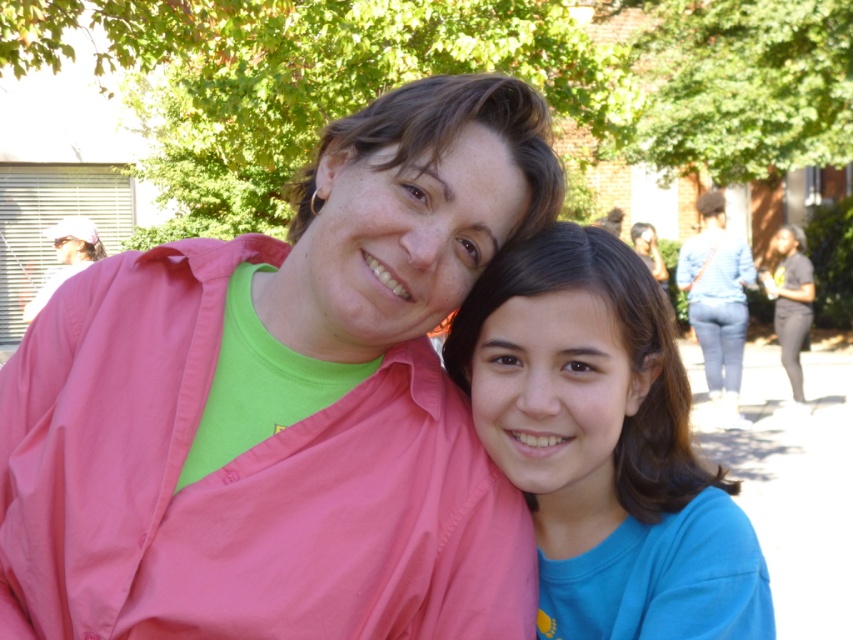
Question: Among these objects, which one is farthest from the camera?

Choices:
 (A) black matte shirt at right
 (B) blue jeans at right
 (C) blue cotton shirt at center
 (D) pink cotton shirt at center

Answer: (A)

Question: Can you confirm if pink cotton shirt at center is positioned to the left of blue cotton shirt at center?

Choices:
 (A) no
 (B) yes

Answer: (B)

Question: Estimate the real-world distances between objects in this image. Which object is farther from the blue cotton shirt at center?

Choices:
 (A) black matte shirt at right
 (B) blue jeans at right

Answer: (A)

Question: Is blue cotton shirt at center behind black matte shirt at right?

Choices:
 (A) yes
 (B) no

Answer: (B)

Question: In this image, where is blue cotton shirt at center located relative to black matte shirt at right?

Choices:
 (A) left
 (B) right

Answer: (A)

Question: Which of these objects is positioned farthest from the black matte shirt at right?

Choices:
 (A) pink cotton shirt at center
 (B) blue cotton shirt at center
 (C) blue jeans at right

Answer: (A)